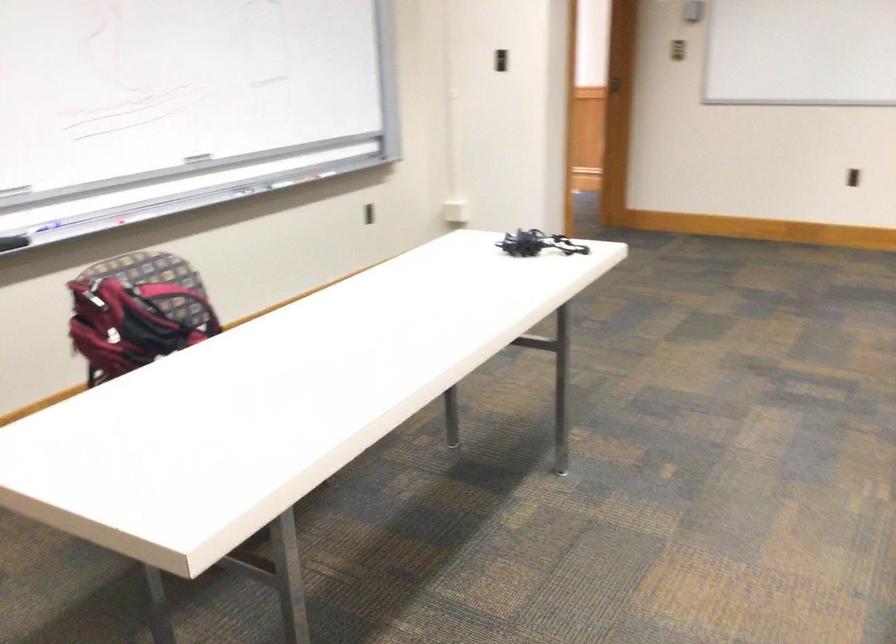
Locate an element on the screen. The image size is (896, 644). black backpack handle is located at coordinates (177, 301).